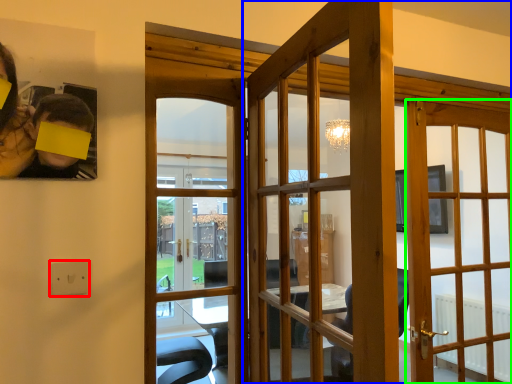
Question: Which object is the closest to the electric outlet (highlighted by a red box)? Choose among these: door (highlighted by a blue box) or door (highlighted by a green box).

Choices:
 (A) door
 (B) door

Answer: (A)